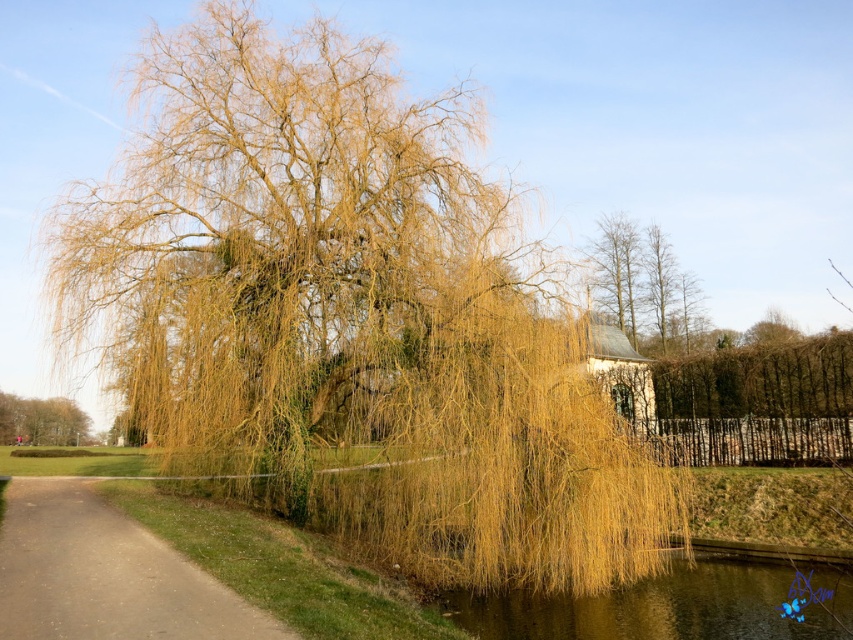
You are standing in the middle of the scene and see the point marked at coordinates (x=350, y=316). What object is located at that point?

The point at coordinates (x=350, y=316) marks the yellow green textured willow at center.